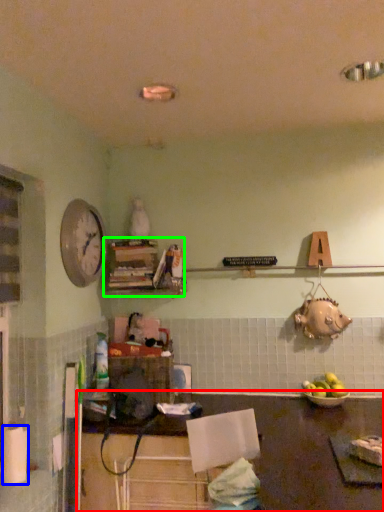
Question: Estimate the real-world distances between objects in this image. Which object is closer to table (highlighted by a red box), paper towel (highlighted by a blue box) or shelf (highlighted by a green box)?

Choices:
 (A) paper towel
 (B) shelf

Answer: (B)